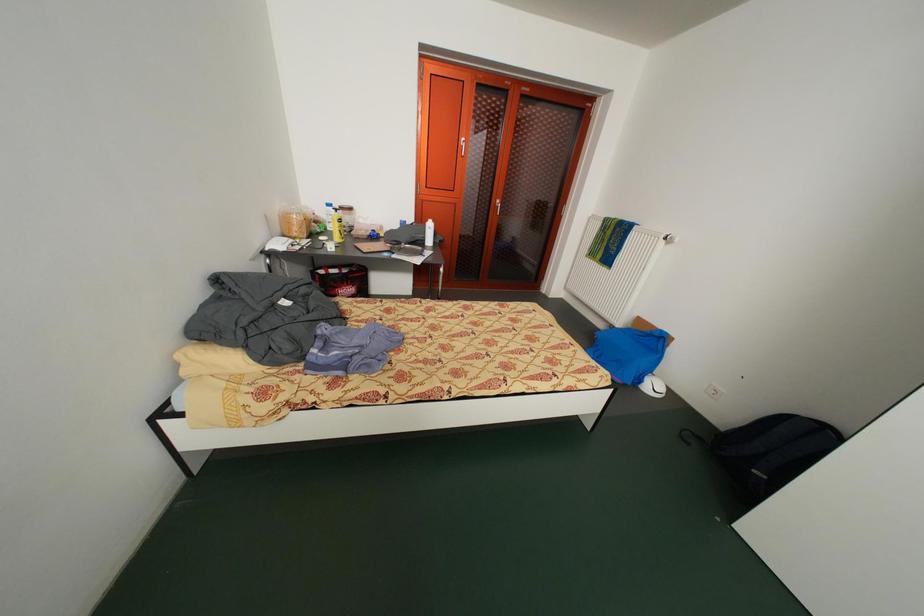
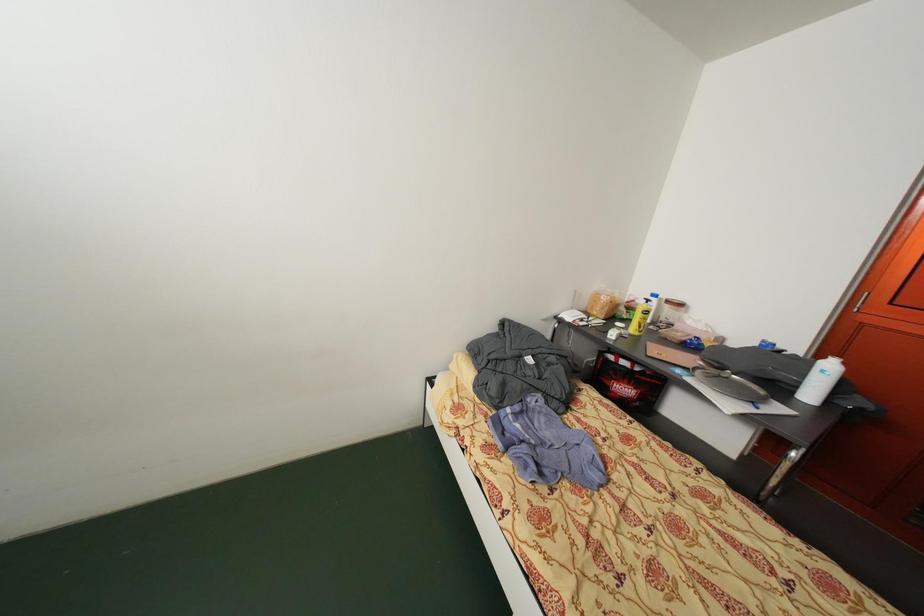
Question: The first image is from the beginning of the video and the second image is from the end. How did the camera likely rotate when shooting the video?

Choices:
 (A) Left
 (B) Right
 (C) Up
 (D) Down

Answer: (A)